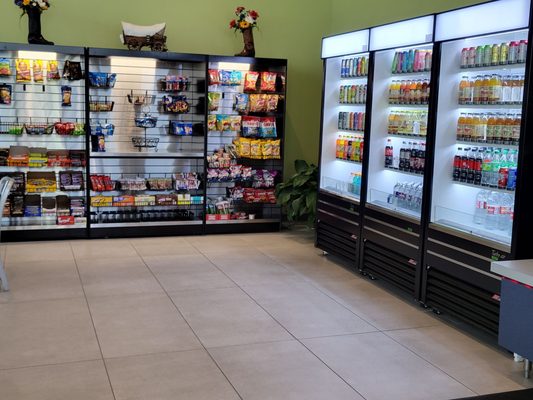
Identify the location of displays. The width and height of the screenshot is (533, 400). (53, 124), (154, 131), (260, 142).